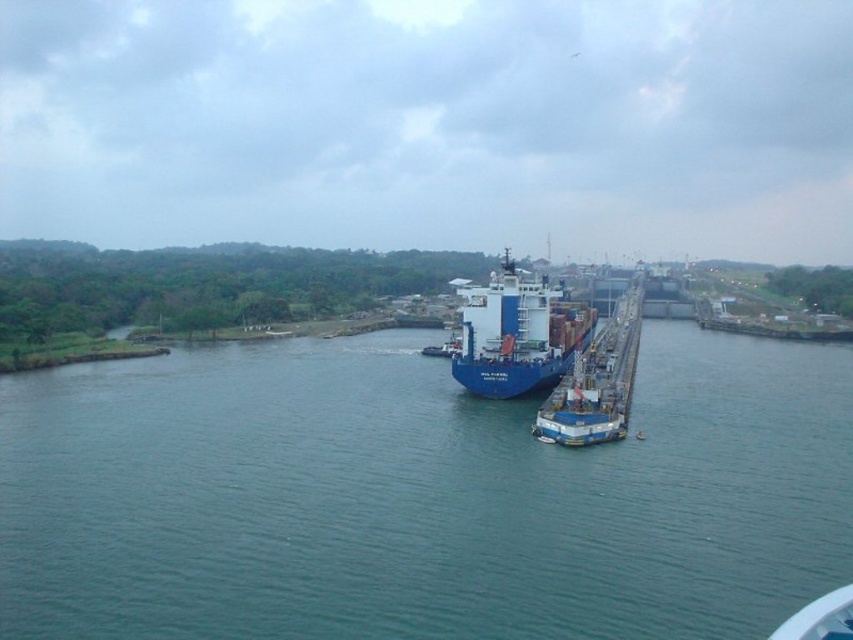
Question: Does blue metallic water at center appear on the left side of blue matte container ship at center?

Choices:
 (A) yes
 (B) no

Answer: (A)

Question: Does blue metallic water at center lie behind blue matte container ship at center?

Choices:
 (A) yes
 (B) no

Answer: (B)

Question: Is blue metallic water at center further to the viewer compared to blue matte container ship at center?

Choices:
 (A) yes
 (B) no

Answer: (B)